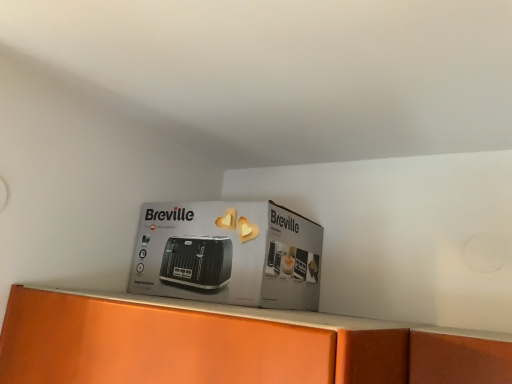
Question: Is matte black toaster at center in front of or behind black plastic toaster at center in the image?

Choices:
 (A) behind
 (B) front

Answer: (B)

Question: Would you say matte black toaster at center is to the left or to the right of black plastic toaster at center in the picture?

Choices:
 (A) left
 (B) right

Answer: (A)

Question: From a real-world perspective, relative to black plastic toaster at center, is matte black toaster at center vertically above or below?

Choices:
 (A) above
 (B) below

Answer: (A)

Question: In terms of size, does black plastic toaster at center appear bigger or smaller than matte black toaster at center?

Choices:
 (A) big
 (B) small

Answer: (A)

Question: Is black plastic toaster at center situated inside matte black toaster at center or outside?

Choices:
 (A) inside
 (B) outside

Answer: (B)

Question: Considering their positions, is black plastic toaster at center located in front of or behind matte black toaster at center?

Choices:
 (A) front
 (B) behind

Answer: (B)

Question: In terms of width, does black plastic toaster at center look wider or thinner when compared to matte black toaster at center?

Choices:
 (A) thin
 (B) wide

Answer: (B)